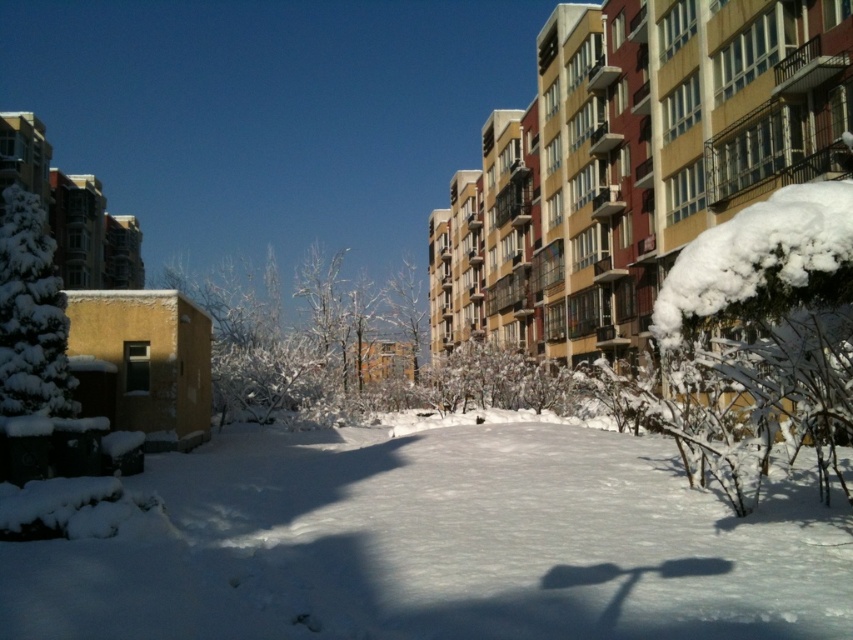
Which is more to the left, white fluffy snow at center or white fluffy snow at lower right?

white fluffy snow at center

Is white fluffy snow at center positioned in front of white fluffy snow at lower right?

That is True.

Who is more forward, (451, 547) or (851, 250)?

Point (851, 250)

Where is `white fluffy snow at center`? The width and height of the screenshot is (853, 640). white fluffy snow at center is located at coordinates (440, 547).

From the picture: Does white frosty tree at center have a larger size compared to white fluffy snow at lower right?

Yes.

Is white frosty tree at center positioned behind white fluffy snow at lower right?

Yes, white frosty tree at center is further from the viewer.

Is point (321, 259) behind point (752, 250)?

That is True.

The height and width of the screenshot is (640, 853). I want to click on white frosty tree at center, so click(x=292, y=337).

Who is higher up, white fluffy snow at lower right or green fluffy tree at left?

white fluffy snow at lower right is above.

Does white fluffy snow at lower right have a greater width compared to green fluffy tree at left?

Incorrect, white fluffy snow at lower right's width does not surpass green fluffy tree at left's.

Which is in front, point (848, 179) or point (33, 400)?

Point (848, 179)

At what (x,y) coordinates should I click in order to perform the action: click on white fluffy snow at lower right. Please return your answer as a coordinate pair (x, y). Looking at the image, I should click on (756, 253).